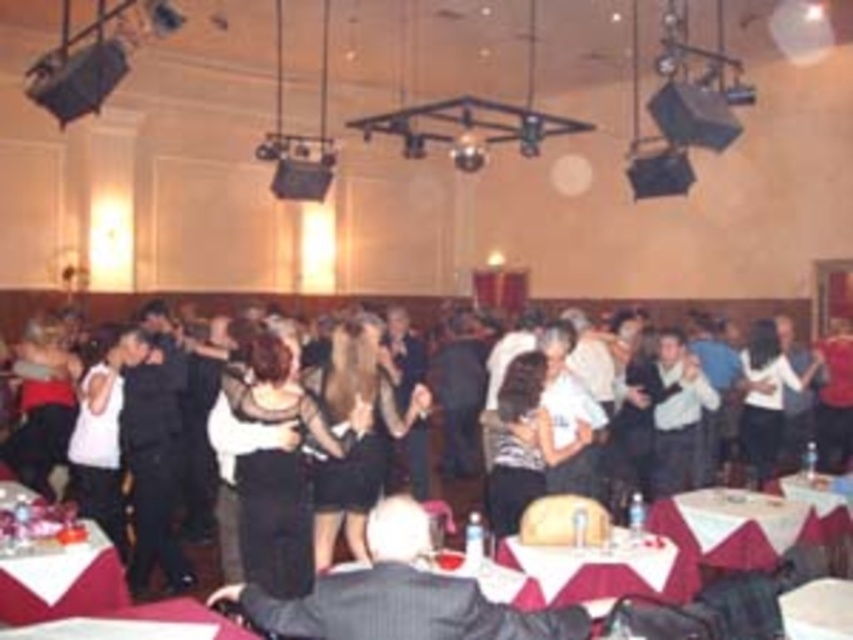
You are a guest at the event and need to place a small gift on the smooth white tablecloth at lower left or the white paper at lower right. Which surface has a larger width to accommodate the gift?

The smooth white tablecloth at lower left has a larger width than the white paper at lower right, so it can accommodate the gift better.